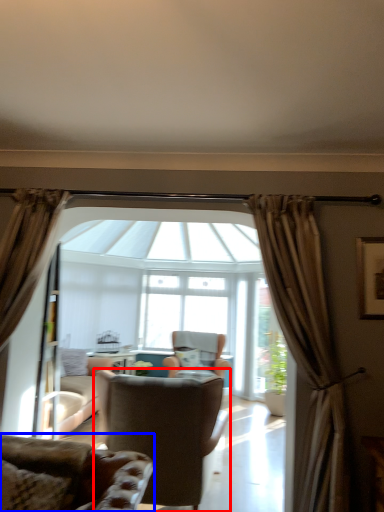
Question: Which of the following is the closest to the observer, chair (highlighted by a red box) or chair (highlighted by a blue box)?

Choices:
 (A) chair
 (B) chair

Answer: (B)